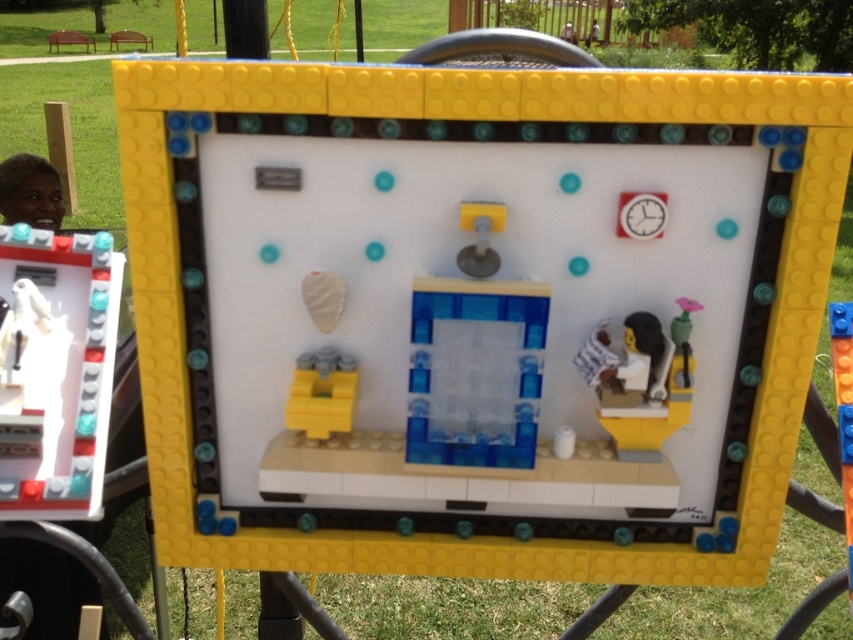
Question: Based on their relative distances, which object is farther from the yellow plastic bricks at lower left?

Choices:
 (A) smooth plastic figure at right
 (B) matte black face at upper left

Answer: (B)

Question: Which of the following is the farthest from the observer?

Choices:
 (A) (28, 241)
 (B) (670, 333)
 (C) (48, 188)
 (D) (312, 371)

Answer: (C)

Question: Where is matte black face at upper left located in relation to smooth plastic figure at right in the image?

Choices:
 (A) left
 (B) right

Answer: (A)

Question: Which point is farther to the camera?

Choices:
 (A) (318, 392)
 (B) (35, 419)
 (C) (686, 320)
 (D) (49, 209)

Answer: (D)

Question: Is white glossy statue at left smaller than yellow plastic bricks at lower left?

Choices:
 (A) yes
 (B) no

Answer: (B)

Question: Considering the relative positions of white glossy statue at left and matte black face at upper left in the image provided, where is white glossy statue at left located with respect to matte black face at upper left?

Choices:
 (A) right
 (B) left

Answer: (A)